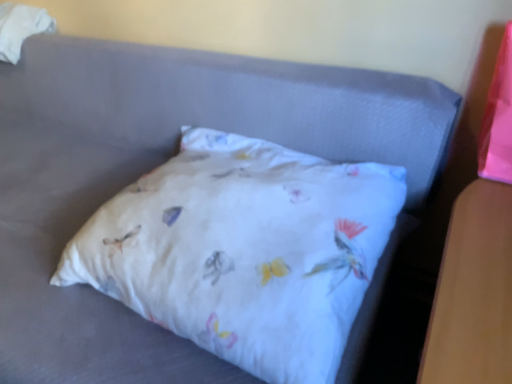
Question: From the image's perspective, is white fabric pillow at center on white fabric at upper left?

Choices:
 (A) no
 (B) yes

Answer: (A)

Question: Is white fabric pillow at center turned away from white fabric at upper left?

Choices:
 (A) yes
 (B) no

Answer: (B)

Question: Is white fabric pillow at center positioned in front of white fabric at upper left?

Choices:
 (A) yes
 (B) no

Answer: (A)

Question: Is white fabric pillow at center aimed at white fabric at upper left?

Choices:
 (A) yes
 (B) no

Answer: (B)

Question: Is white fabric pillow at center shorter than white fabric at upper left?

Choices:
 (A) yes
 (B) no

Answer: (A)

Question: From a real-world perspective, is white fabric pillow at center beneath white fabric at upper left?

Choices:
 (A) no
 (B) yes

Answer: (B)

Question: Can you confirm if white fabric at upper left is shorter than white fabric pillow at center?

Choices:
 (A) no
 (B) yes

Answer: (A)

Question: Can you confirm if white fabric at upper left is taller than white fabric pillow at center?

Choices:
 (A) no
 (B) yes

Answer: (B)

Question: From a real-world perspective, is white fabric at upper left located higher than white fabric pillow at center?

Choices:
 (A) no
 (B) yes

Answer: (B)

Question: Is white fabric at upper left at the right side of white fabric pillow at center?

Choices:
 (A) yes
 (B) no

Answer: (B)

Question: Is white fabric at upper left positioned with its back to white fabric pillow at center?

Choices:
 (A) yes
 (B) no

Answer: (B)

Question: From a real-world perspective, is white fabric at upper left below white fabric pillow at center?

Choices:
 (A) yes
 (B) no

Answer: (B)

Question: From a real-world perspective, is white fabric pillow at center positioned above or below white fabric at upper left?

Choices:
 (A) above
 (B) below

Answer: (B)